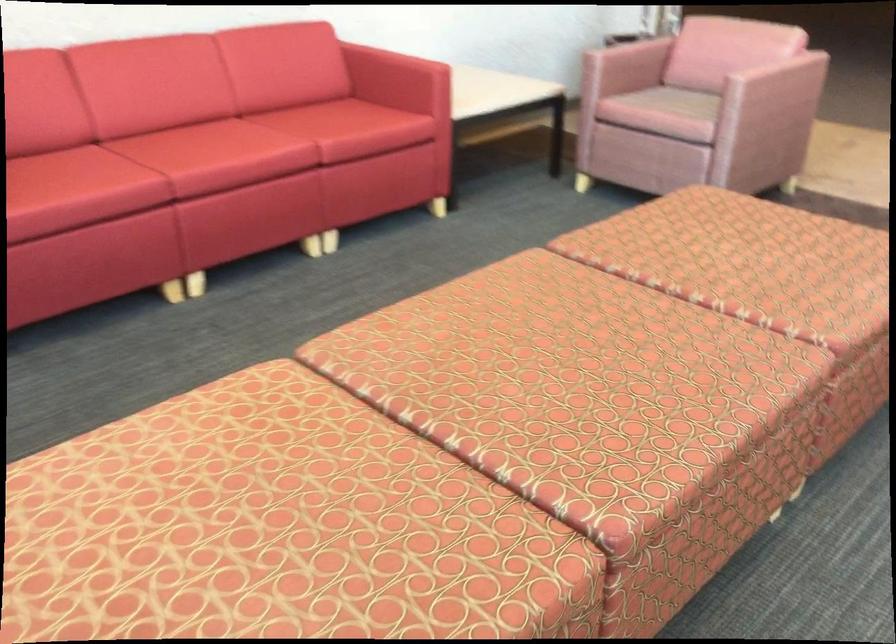
This screenshot has width=896, height=644. Identify the location of chair sitting surface. (686, 102).